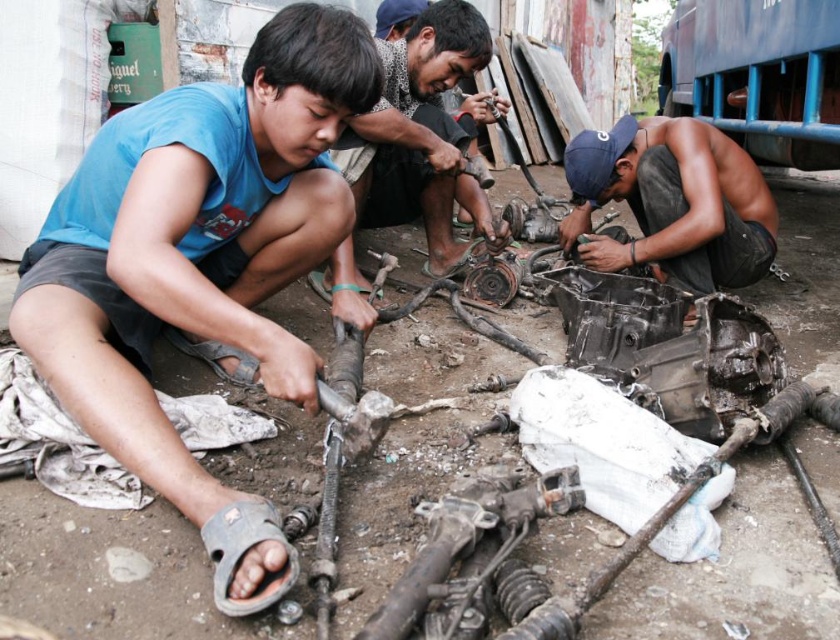
Question: Which object is closer to the camera taking this photo?

Choices:
 (A) matte black engine part at center
 (B) shiny metallic engine part at center

Answer: (B)

Question: In this image, where is matte blue shirt at lower left located relative to shiny metallic engine part at center?

Choices:
 (A) above
 (B) below

Answer: (B)

Question: Which of the following is the closest to the observer?

Choices:
 (A) shiny metallic engine part at center
 (B) matte black engine part at center
 (C) matte blue shirt at lower left

Answer: (C)

Question: Where is shiny metallic engine part at center located in relation to matte black engine part at center in the image?

Choices:
 (A) below
 (B) above

Answer: (A)

Question: Is matte blue shirt at lower left thinner than shiny metallic engine part at center?

Choices:
 (A) no
 (B) yes

Answer: (A)

Question: Which of these objects is positioned closest to the matte black engine part at center?

Choices:
 (A) matte blue shirt at lower left
 (B) shiny metallic engine part at center

Answer: (B)